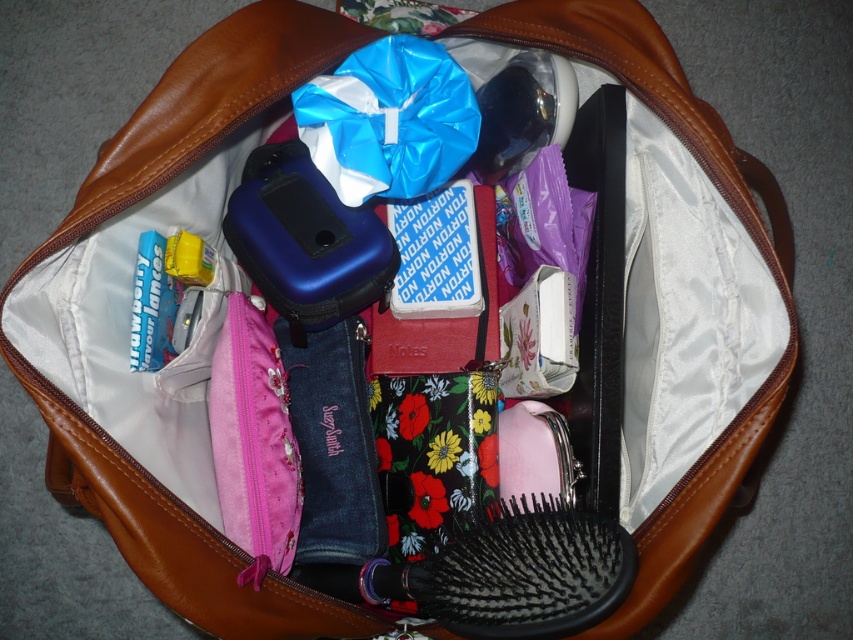
Question: Is black plastic hairbrush at center below blue shiny plastic bag at center?

Choices:
 (A) yes
 (B) no

Answer: (A)

Question: Which object is farther from the camera taking this photo?

Choices:
 (A) black plastic hairbrush at center
 (B) blue shiny plastic bag at center

Answer: (B)

Question: Is black plastic hairbrush at center bigger than blue shiny plastic bag at center?

Choices:
 (A) yes
 (B) no

Answer: (A)

Question: Is the position of black plastic hairbrush at center more distant than that of blue shiny plastic bag at center?

Choices:
 (A) yes
 (B) no

Answer: (B)